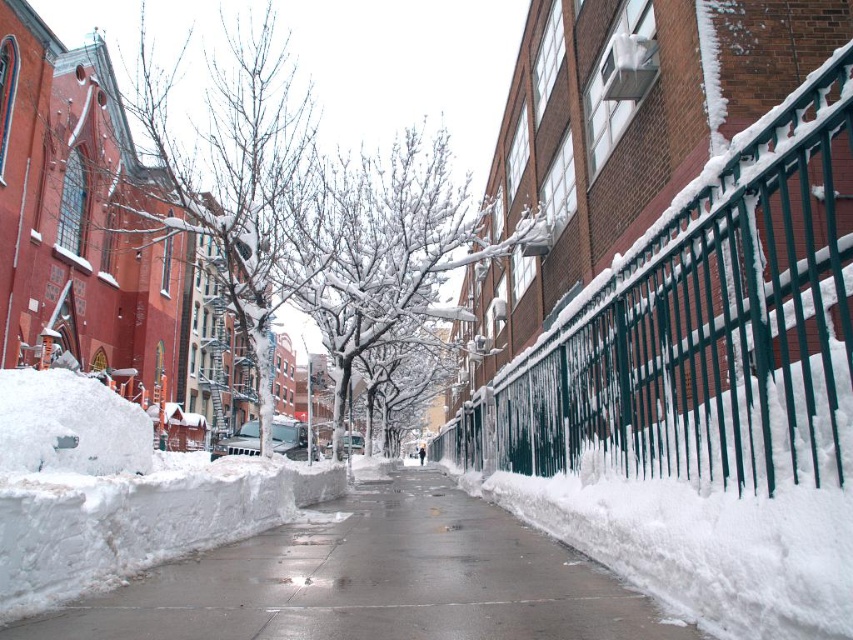
Is green wrought iron fence at right thinner than smooth concrete sidewalk at center?

Yes.

Does point (798, 339) come behind point (398, 547)?

No, it is not.

Find the location of a particular element. The width and height of the screenshot is (853, 640). green wrought iron fence at right is located at coordinates (703, 326).

Between smooth concrete sidewalk at center and snow-covered branches at left, which one is positioned lower?

smooth concrete sidewalk at center

Based on the photo, can you confirm if smooth concrete sidewalk at center is positioned to the left of snow-covered branches at left?

No, smooth concrete sidewalk at center is not to the left of snow-covered branches at left.

Where is `smooth concrete sidewalk at center`? The width and height of the screenshot is (853, 640). smooth concrete sidewalk at center is located at coordinates (373, 580).

Does snow-covered branches at left lie in front of snow-covered branches at center?

That is True.

Does point (252, 349) come farther from viewer compared to point (425, 209)?

No.

What are the coordinates of `snow-covered branches at left` in the screenshot? It's located at (230, 196).